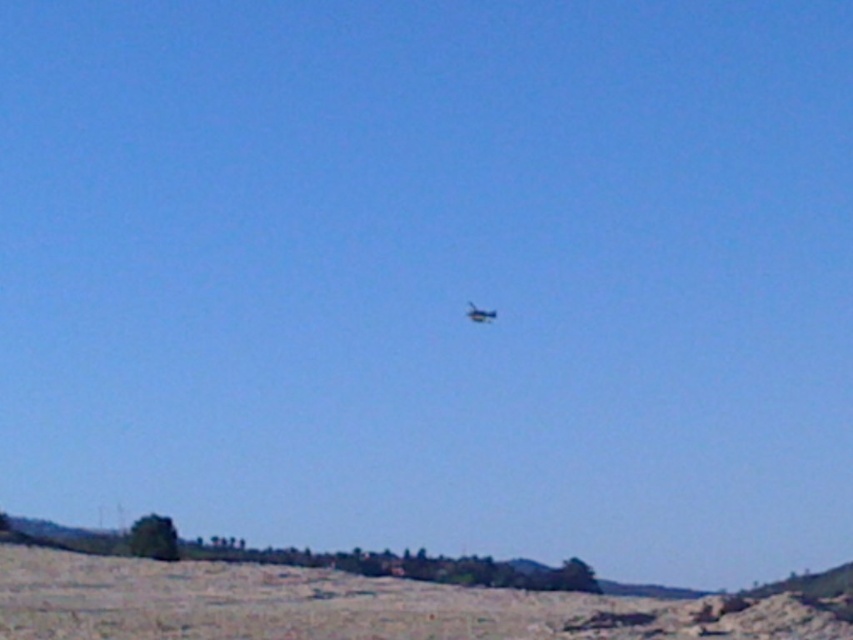
You are a pilot flying a metallic blue helicopter at center and need to land it on the brown sandy dirt field at lower center. Can you safely land the helicopter on the field based on their sizes?

The brown sandy dirt field at lower center is wider than the metallic blue helicopter at center, so yes, the helicopter can safely land on the field since the field is wider than the helicopter.

You are a pilot flying a shiny blue airplane at center. You need to land your plane on the brown sandy dirt field at lower center. Can you safely land your plane there based on the size of the field compared to your plane?

The brown sandy dirt field at lower center is larger in size than the shiny blue airplane at center, so yes, the plane can safely land there as the field is big enough to accommodate it.

You are a pilot trying to land your aircraft in this open landscape. You see a metallic blue helicopter at center and a shiny blue airplane at center. Which aircraft should you avoid landing near to ensure you have enough space for your landing gear?

You should avoid landing near the shiny blue airplane at center because the distance between the metallic blue helicopter at center and the shiny blue airplane at center is only 4.13 centimeters, which may not provide sufficient space for landing gear.